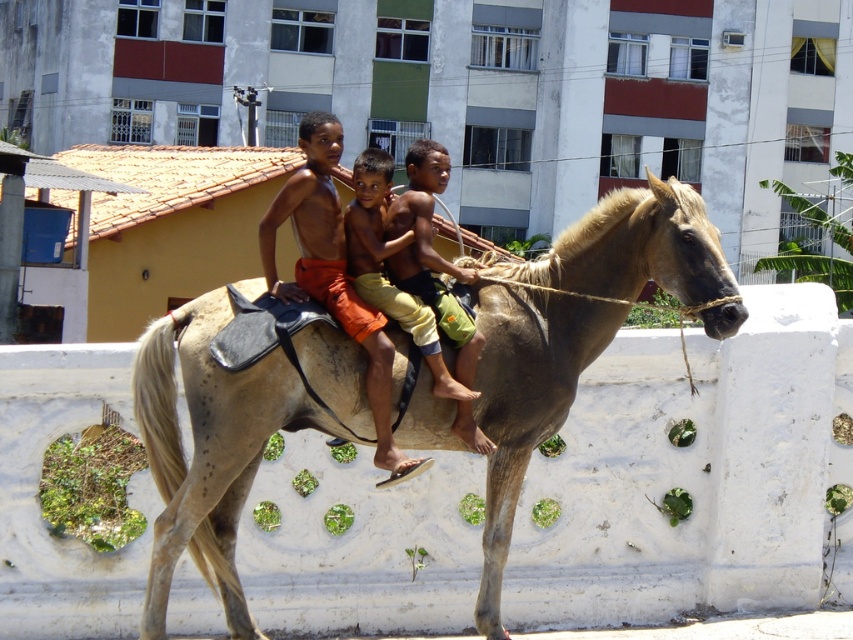
You are a photographer trying to capture a photo of the light brown skin at center and the tan skin boy at center. Since you want to ensure both subjects are in focus, you need to know which one is wider. Which boy has a greater width?

The light brown skin at center has a greater width than the tan skin boy at center.

What are the coordinates of the light brown leather horse at center?

The light brown leather horse at center is located at coordinates point (573, 333).

You are a photographer taking a picture of the light brown skin at center and the tan skin boy at center. Which boy should you focus on first if you want to capture both in the frame without moving the camera?

You should focus on the light brown skin at center first because it is positioned to the left of the tan skin boy at center, so capturing the left side first ensures both are in frame.